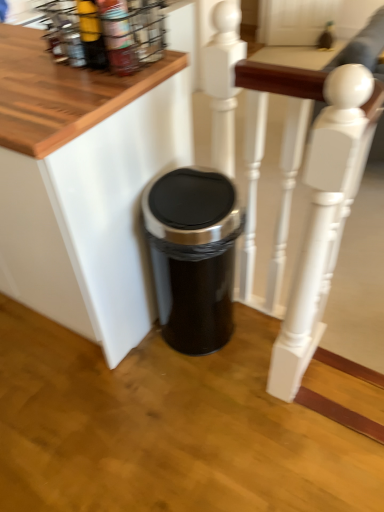
What are the coordinates of `free region on the left part of black metallic trash can at center` in the screenshot? It's located at (129, 361).